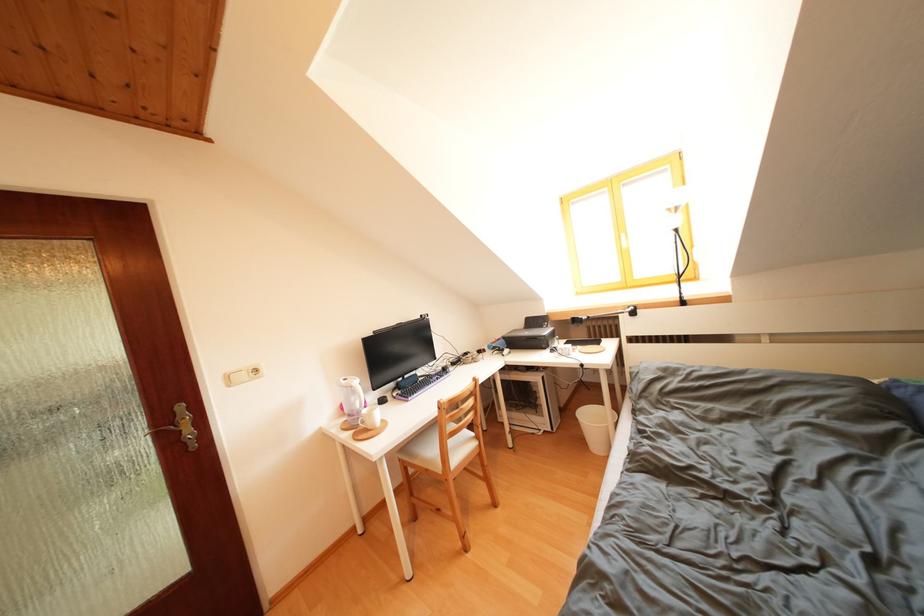
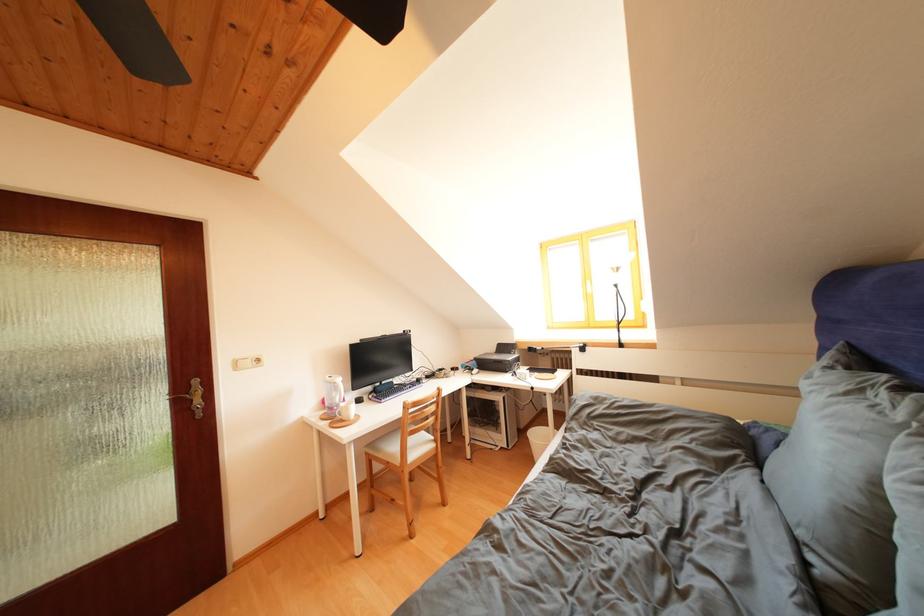
Where in the second image is the point corresponding to (x=596, y=421) from the first image?

(542, 439)